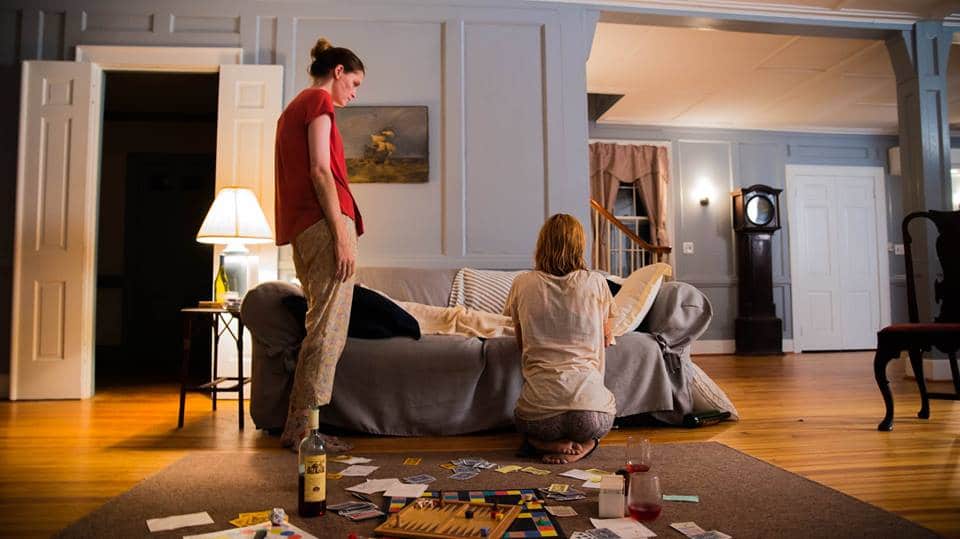
I want to click on pillow, so click(x=698, y=389).